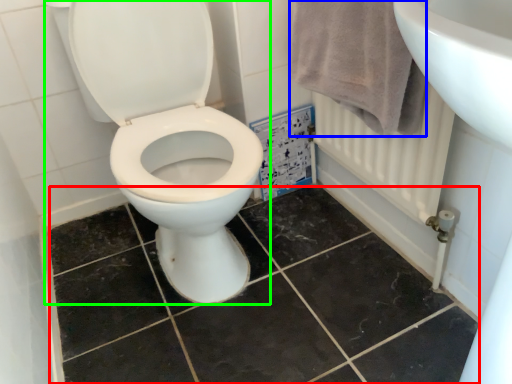
Question: Which is nearer to the ceramic tile (highlighted by a red box)? bath towel (highlighted by a blue box) or toilet (highlighted by a green box).

Choices:
 (A) bath towel
 (B) toilet

Answer: (B)